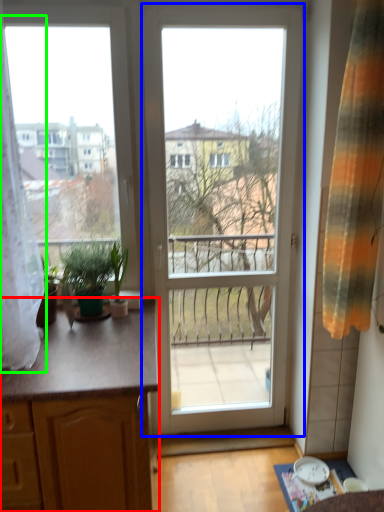
Question: Based on their relative distances, which object is nearer to cabinetry (highlighted by a red box)? Choose from door (highlighted by a blue box) and curtain (highlighted by a green box).

Choices:
 (A) door
 (B) curtain

Answer: (B)